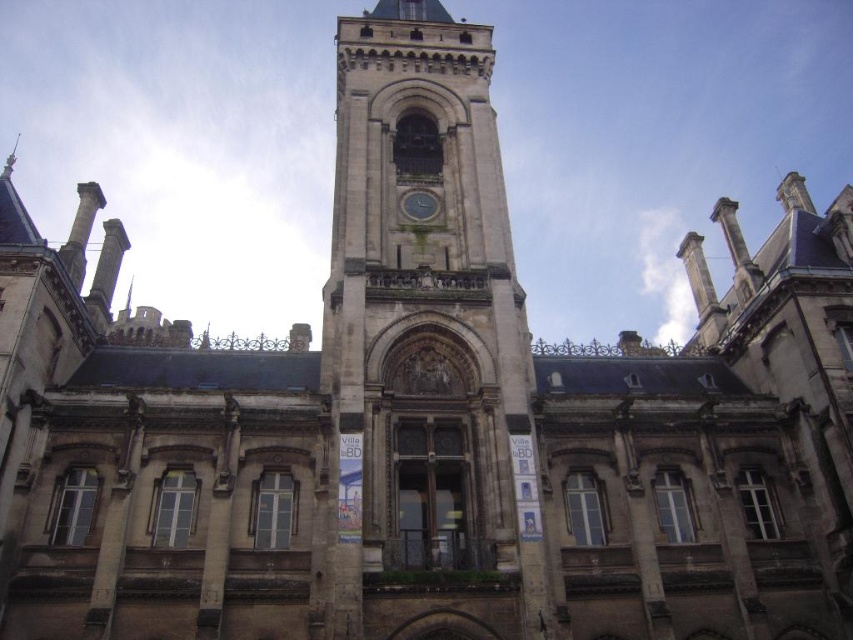
You are an architect analyzing the symmetry of the building. Given the brown stone clock tower at center and the green glass clock at center, which one has a greater width?

The brown stone clock tower at center has a greater width than the green glass clock at center according to the description.

You are standing in front of the grand historic building and want to take a photo of both the brown stone clock tower at center and the green glass clock at center. Which object will appear larger in your photo?

The brown stone clock tower at center will appear larger in the photo because it is closer to the viewer than the green glass clock at center.

You are a maintenance worker tasked with checking both the brown stone clock tower at center and the green glass clock at center. You have a ladder that is 45 feet long. Can you safely reach both clocks with your current ladder without needing a longer one?

The distance between the brown stone clock tower at center and the green glass clock at center is 48.82 feet. Since the ladder is only 45 feet long, it is not long enough to bridge the gap between them. Therefore, you cannot safely reach both clocks with the current ladder.